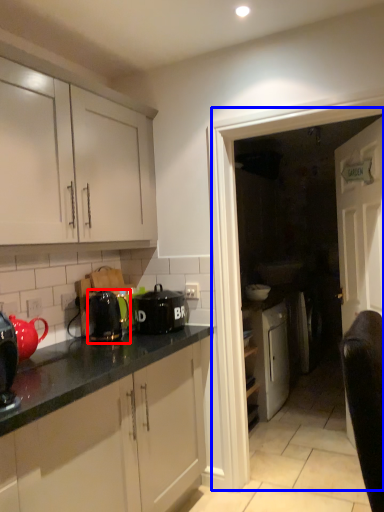
Question: Which object is further to the camera taking this photo, kitchen appliance (highlighted by a red box) or glass door (highlighted by a blue box)?

Choices:
 (A) kitchen appliance
 (B) glass door

Answer: (A)